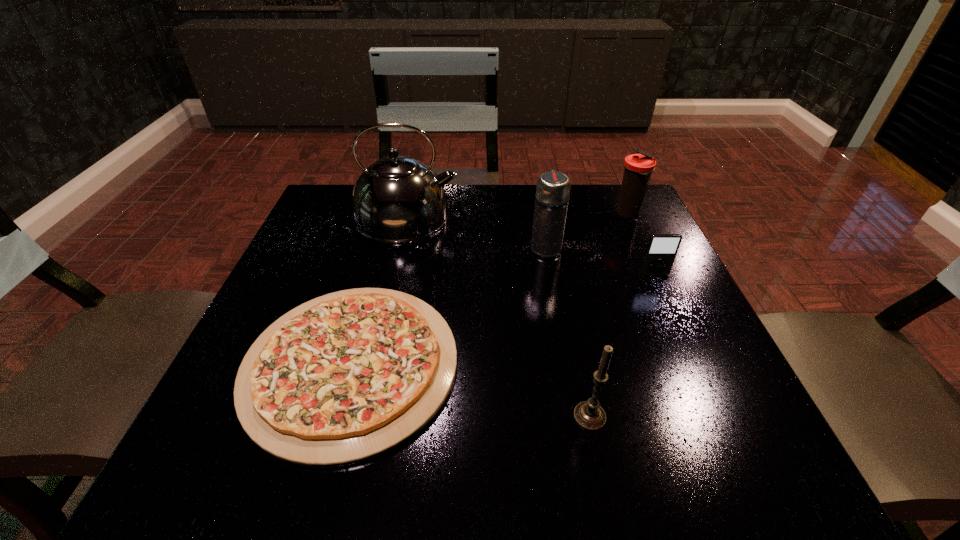
Where is `free space between the right thermos bottle and the candle`? free space between the right thermos bottle and the candle is located at coordinates (609, 315).

Choose which object is the fourth nearest neighbor to the third nearest object. Please provide its 2D coordinates. Your answer should be formatted as a tuple, i.e. [(x, y)], where the tuple contains the x and y coordinates of a point satisfying the conditions above.

[(348, 376)]

At what (x,y) coordinates should I click in order to perform the action: click on the fifth closest object to the pizza. Please return your answer as a coordinate pair (x, y). This screenshot has width=960, height=540. Looking at the image, I should click on (638, 168).

Locate an element on the screen. The image size is (960, 540). free region that satisfies the following two spatial constraints: 1. on the back side of the candle; 2. from the spout of the tallest object is located at coordinates (547, 215).

You are a GUI agent. You are given a task and a screenshot of the screen. Output one action in this format:
    pyautogui.click(x=<x>, y=<y>)
    Task: Click on the free spot that satisfies the following two spatial constraints: 1. with a handle on the side of the nearer thermos bottle; 2. from the spout of the tallest object
    The image size is (960, 540).
    Given the screenshot: What is the action you would take?
    pyautogui.click(x=540, y=215)

Locate an element on the screen. Image resolution: width=960 pixels, height=540 pixels. free spot that satisfies the following two spatial constraints: 1. with a handle on the side of the nearer thermos bottle; 2. from the spout of the tallest object is located at coordinates [540, 215].